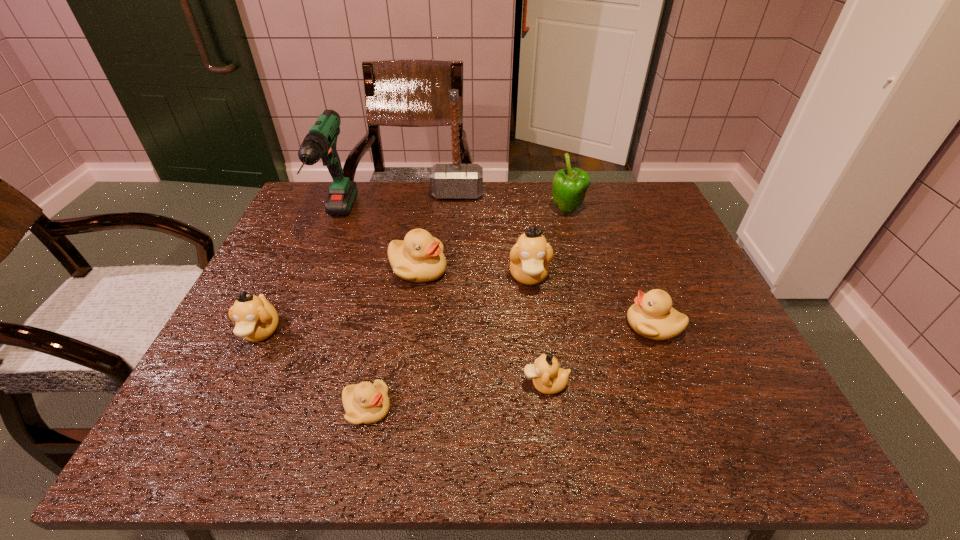
This screenshot has height=540, width=960. What are the coordinates of `empty space between the smallest tan duckling and the second biggest yellow duckling` in the screenshot? It's located at (599, 355).

Identify which object is the closest to the brown hammer. Please provide its 2D coordinates. Your answer should be formatted as a tuple, i.e. [(x, y)], where the tuple contains the x and y coordinates of a point satisfying the conditions above.

[(570, 185)]

Identify which object is the third nearest to the rightmost duckling. Please provide its 2D coordinates. Your answer should be formatted as a tuple, i.e. [(x, y)], where the tuple contains the x and y coordinates of a point satisfying the conditions above.

[(570, 185)]

Locate which duckling is the second closest to the nearest yellow duckling. Please provide its 2D coordinates. Your answer should be formatted as a tuple, i.e. [(x, y)], where the tuple contains the x and y coordinates of a point satisfying the conditions above.

[(548, 378)]

The image size is (960, 540). What are the coordinates of `the third closest duckling to the shortest duckling` in the screenshot? It's located at (419, 258).

Locate which tan duckling ranks in proximity to the rightmost yellow duckling. Please provide its 2D coordinates. Your answer should be formatted as a tuple, i.e. [(x, y)], where the tuple contains the x and y coordinates of a point satisfying the conditions above.

[(529, 258)]

Identify which tan duckling is located as the nearest to the biggest yellow duckling. Please provide its 2D coordinates. Your answer should be formatted as a tuple, i.e. [(x, y)], where the tuple contains the x and y coordinates of a point satisfying the conditions above.

[(529, 258)]

Select which yellow duckling appears as the closest to the rightmost object. Please provide its 2D coordinates. Your answer should be formatted as a tuple, i.e. [(x, y)], where the tuple contains the x and y coordinates of a point satisfying the conditions above.

[(419, 258)]

Locate which yellow duckling is the second closest to the rightmost yellow duckling. Please provide its 2D coordinates. Your answer should be formatted as a tuple, i.e. [(x, y)], where the tuple contains the x and y coordinates of a point satisfying the conditions above.

[(365, 403)]